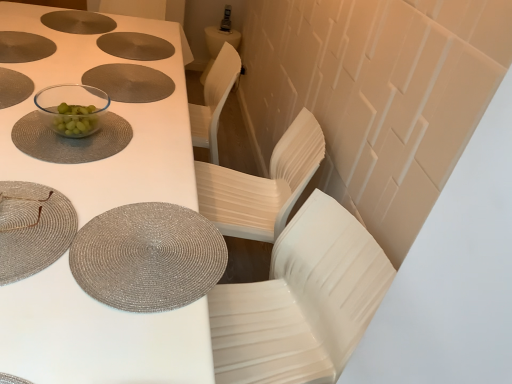
The image size is (512, 384). I want to click on free space between silver woven placemat at lower left, which is the first tableware in front-to-back order, and transparent glass bowl at center, positioned as the fourth tableware in front-to-back order, so click(x=49, y=156).